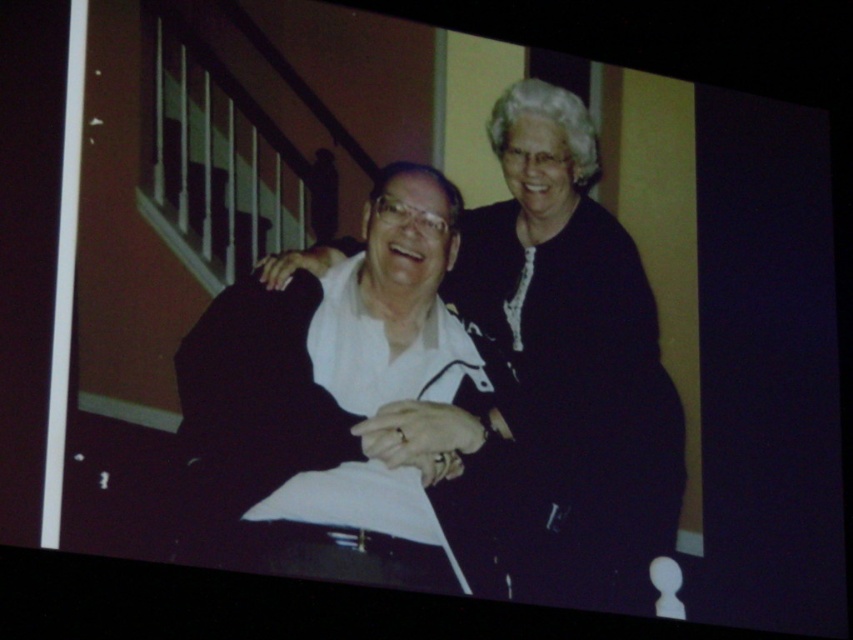
Between point (521, 195) and point (357, 356), which one is positioned behind?

Positioned behind is point (521, 195).

Is black satin dress at center taller than white matte shirt at center?

Yes.

The height and width of the screenshot is (640, 853). What do you see at coordinates (561, 376) in the screenshot?
I see `black satin dress at center` at bounding box center [561, 376].

Locate an element on the screen. This screenshot has width=853, height=640. black satin dress at center is located at coordinates (561, 376).